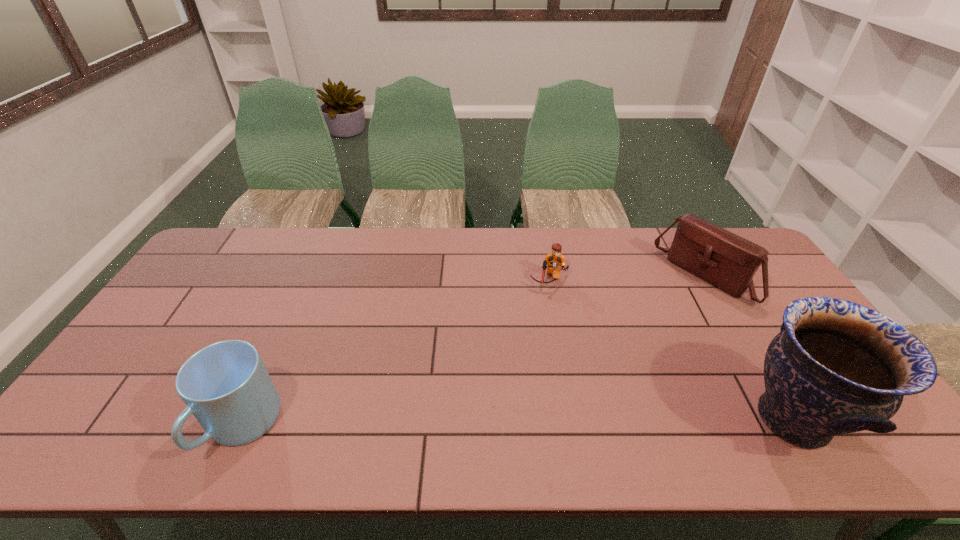
The width and height of the screenshot is (960, 540). What are the coordinates of `vacant space located holding a crossbow in the hands of the third object from right to left` in the screenshot? It's located at (537, 360).

At what (x,y) coordinates should I click in order to perform the action: click on vacant space located 0.160m holding a crossbow in the hands of the third object from right to left. Please return your answer as a coordinate pair (x, y). Looking at the image, I should click on (541, 328).

In order to click on free space located 0.360m on the front flap of the shoulder bag in this screenshot , I will do `click(612, 358)`.

Find the location of a particular element. The image size is (960, 540). free region located 0.320m on the front flap of the shoulder bag is located at coordinates (621, 350).

Locate an element on the screen. The image size is (960, 540). vacant space situated 0.060m on the front flap of the shoulder bag is located at coordinates (673, 307).

The width and height of the screenshot is (960, 540). I want to click on object that is at the far edge, so click(729, 262).

Locate an element on the screen. The image size is (960, 540). mug present at the near edge is located at coordinates (226, 386).

The height and width of the screenshot is (540, 960). In order to click on pottery positioned at the near edge in this screenshot , I will do `click(836, 367)`.

Where is `pottery situated at the right edge`? The height and width of the screenshot is (540, 960). pottery situated at the right edge is located at coordinates (836, 367).

This screenshot has height=540, width=960. What are the coordinates of `shoulder bag positioned at the right edge` in the screenshot? It's located at (729, 262).